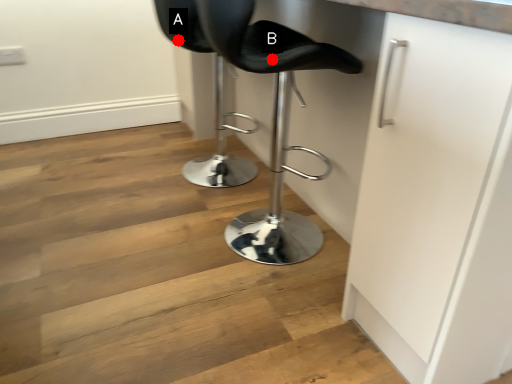
Question: Two points are circled on the image, labeled by A and B beside each circle. Which point appears farthest from the camera in this image?

Choices:
 (A) A is further
 (B) B is further

Answer: (A)